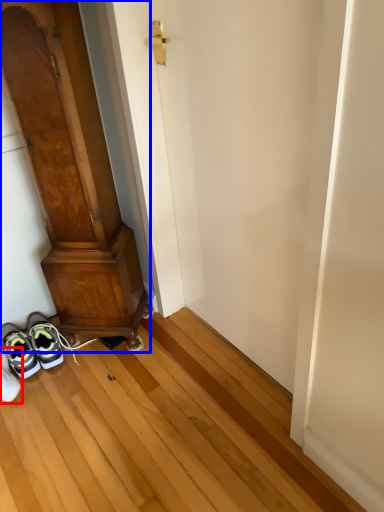
Question: Which object appears closest to the camera in this image, footwear (highlighted by a red box) or door (highlighted by a blue box)?

Choices:
 (A) footwear
 (B) door

Answer: (B)